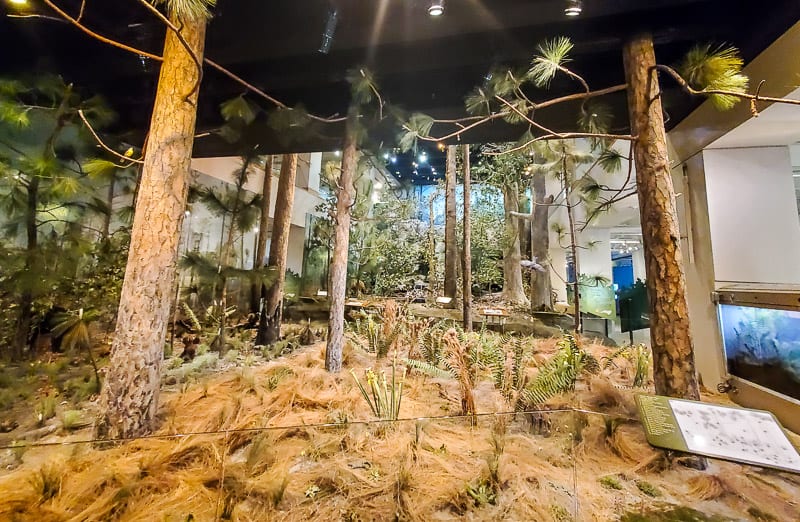
The height and width of the screenshot is (522, 800). Identify the location of lights. (418, 160).